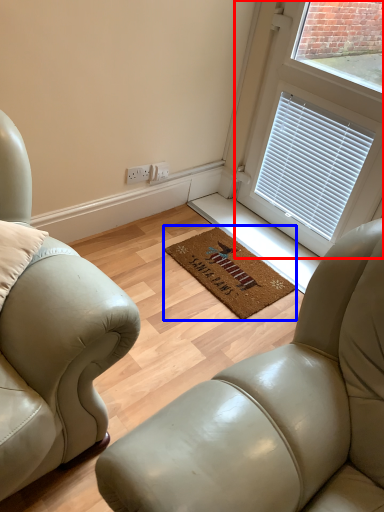
Question: Which object appears farthest to the camera in this image, window (highlighted by a red box) or mat (highlighted by a blue box)?

Choices:
 (A) window
 (B) mat

Answer: (B)